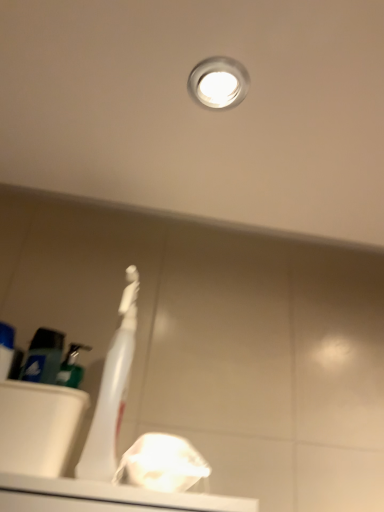
Question: Is white plastic toothbrush at center taller than blue matte toothpaste tube at left?

Choices:
 (A) yes
 (B) no

Answer: (A)

Question: Can you confirm if white plastic toothbrush at center is shorter than blue matte toothpaste tube at left?

Choices:
 (A) no
 (B) yes

Answer: (A)

Question: Does white plastic toothbrush at center appear on the right side of blue matte toothpaste tube at left?

Choices:
 (A) no
 (B) yes

Answer: (B)

Question: Is white plastic toothbrush at center oriented towards blue matte toothpaste tube at left?

Choices:
 (A) yes
 (B) no

Answer: (B)

Question: From the image's perspective, would you say white plastic toothbrush at center is shown under blue matte toothpaste tube at left?

Choices:
 (A) no
 (B) yes

Answer: (A)

Question: From the image's perspective, is white plastic toothbrush at center on blue matte toothpaste tube at left?

Choices:
 (A) no
 (B) yes

Answer: (B)

Question: From a real-world perspective, is white plastic toothbrush at center over white glossy droplight at upper center?

Choices:
 (A) yes
 (B) no

Answer: (B)

Question: Can you confirm if white plastic toothbrush at center is wider than white glossy droplight at upper center?

Choices:
 (A) yes
 (B) no

Answer: (A)

Question: Can you confirm if white plastic toothbrush at center is bigger than white glossy droplight at upper center?

Choices:
 (A) no
 (B) yes

Answer: (B)

Question: Is white plastic toothbrush at center facing towards white glossy droplight at upper center?

Choices:
 (A) yes
 (B) no

Answer: (B)

Question: Considering the relative sizes of white plastic toothbrush at center and white glossy droplight at upper center in the image provided, is white plastic toothbrush at center smaller than white glossy droplight at upper center?

Choices:
 (A) yes
 (B) no

Answer: (B)

Question: From the image's perspective, would you say white plastic toothbrush at center is positioned over white glossy droplight at upper center?

Choices:
 (A) yes
 (B) no

Answer: (B)

Question: From the image's perspective, would you say white glossy droplight at upper center is positioned over white plastic sink at lower left?

Choices:
 (A) no
 (B) yes

Answer: (B)